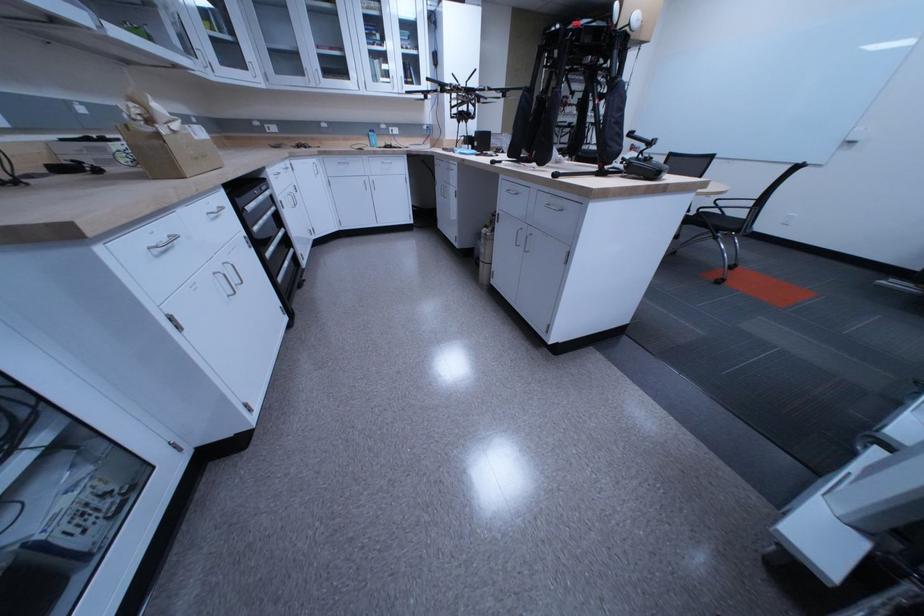
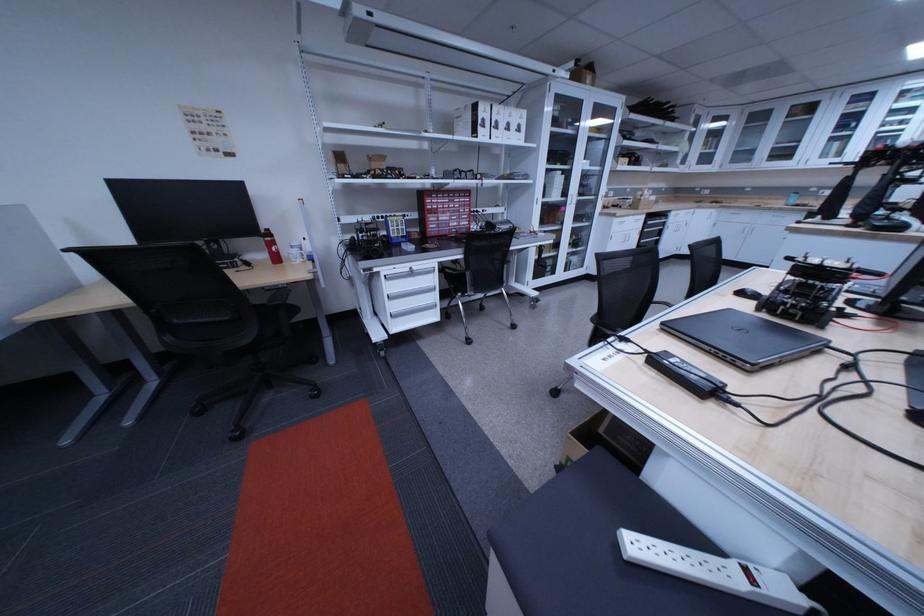
In the second image, find the point that corresponds to point 330,161 in the first image.

(728, 212)